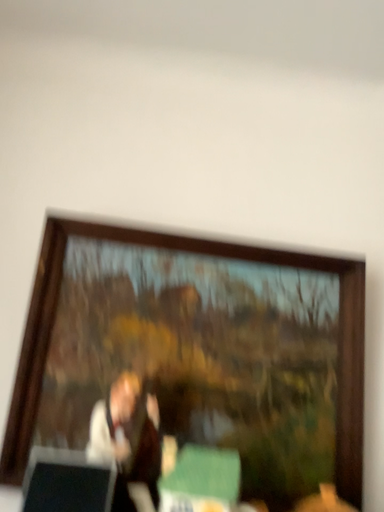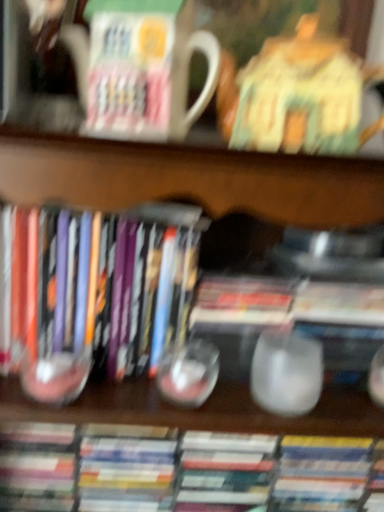
Question: How did the camera likely rotate when shooting the video?

Choices:
 (A) rotated downward
 (B) rotated upward

Answer: (A)